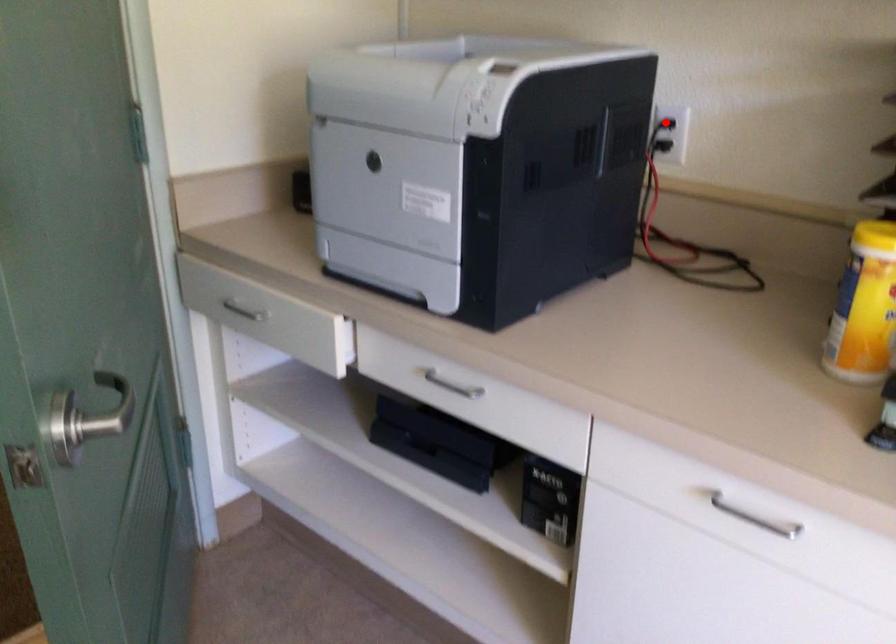
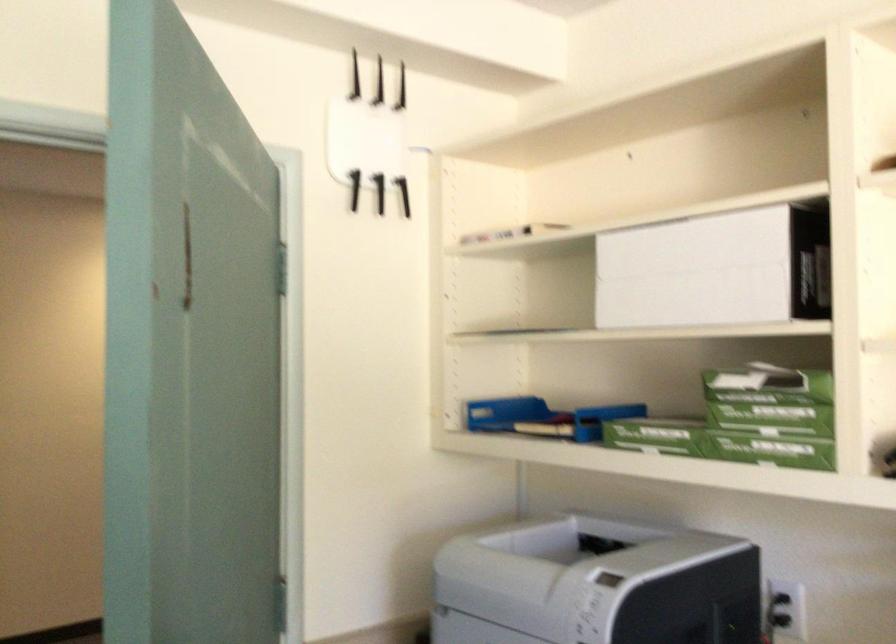
Question: I am providing you with two images of the same scene from different viewpoints. A red point is marked on the first image. Can you still see the location of the red point in image 2?

Choices:
 (A) Yes
 (B) No

Answer: (A)